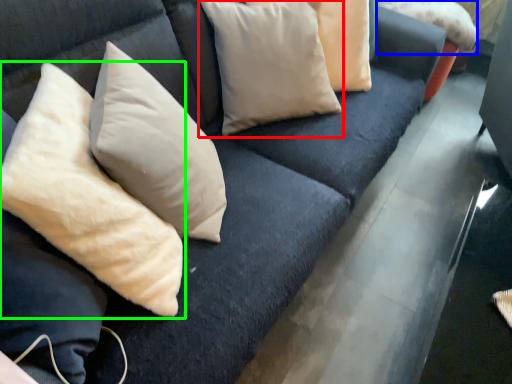
Question: Which object is the closest to the pillow (highlighted by a red box)? Choose among these: pillow (highlighted by a blue box) or pillow (highlighted by a green box).

Choices:
 (A) pillow
 (B) pillow

Answer: (B)